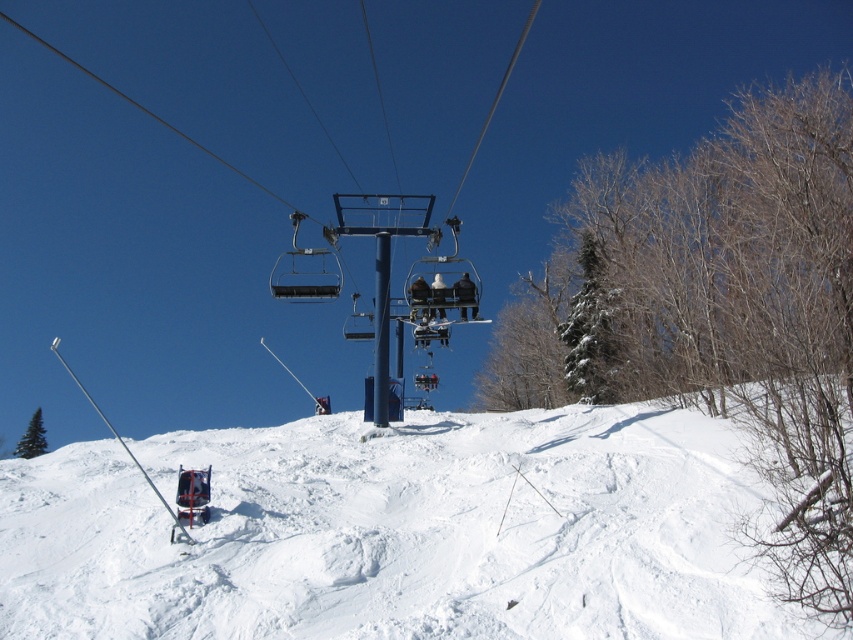
You are standing at the lift station in the center of the ski resort and see two points marked on the slope. The first point is at coordinates point [291,584] and the second point is at point [440,317]. Which point is closer to you?

Point [291,584] is in front of point [440,317], so the first point is closer to you.